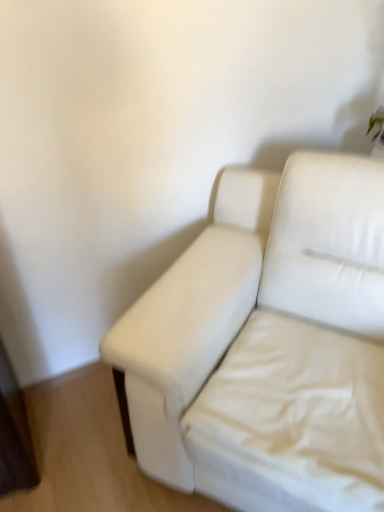
Question: In the image, is white fabric couch at center positioned in front of or behind white fabric sheet at lower right?

Choices:
 (A) front
 (B) behind

Answer: (A)

Question: Considering the relative positions of white fabric couch at center and white fabric sheet at lower right in the image provided, is white fabric couch at center to the left or to the right of white fabric sheet at lower right?

Choices:
 (A) right
 (B) left

Answer: (B)

Question: From their relative heights in the image, would you say white fabric couch at center is taller or shorter than white fabric sheet at lower right?

Choices:
 (A) short
 (B) tall

Answer: (B)

Question: Is point (317, 474) closer or farther from the camera than point (321, 170)?

Choices:
 (A) closer
 (B) farther

Answer: (A)

Question: Based on their sizes in the image, would you say white fabric sheet at lower right is bigger or smaller than white fabric couch at center?

Choices:
 (A) small
 (B) big

Answer: (A)

Question: Based on their positions, is white fabric sheet at lower right located to the left or right of white fabric couch at center?

Choices:
 (A) left
 (B) right

Answer: (B)

Question: Which is correct: white fabric sheet at lower right is inside white fabric couch at center, or outside of it?

Choices:
 (A) inside
 (B) outside

Answer: (A)